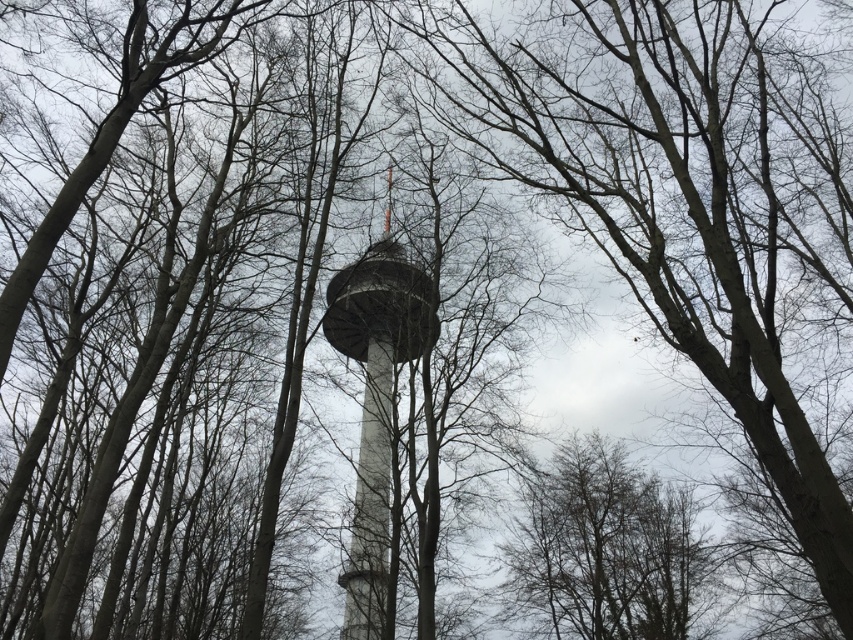
Question: Does brown textured tree at center have a larger size compared to smooth white tower at center?

Choices:
 (A) yes
 (B) no

Answer: (B)

Question: Which point is closer to the camera taking this photo?

Choices:
 (A) (550, 461)
 (B) (380, 356)

Answer: (A)

Question: Which point is closer to the camera?

Choices:
 (A) brown textured tree at center
 (B) smooth white tower at center

Answer: (B)

Question: Does brown textured tree at center appear over smooth white tower at center?

Choices:
 (A) no
 (B) yes

Answer: (A)

Question: Can you confirm if brown textured tree at center is positioned above smooth white tower at center?

Choices:
 (A) no
 (B) yes

Answer: (A)